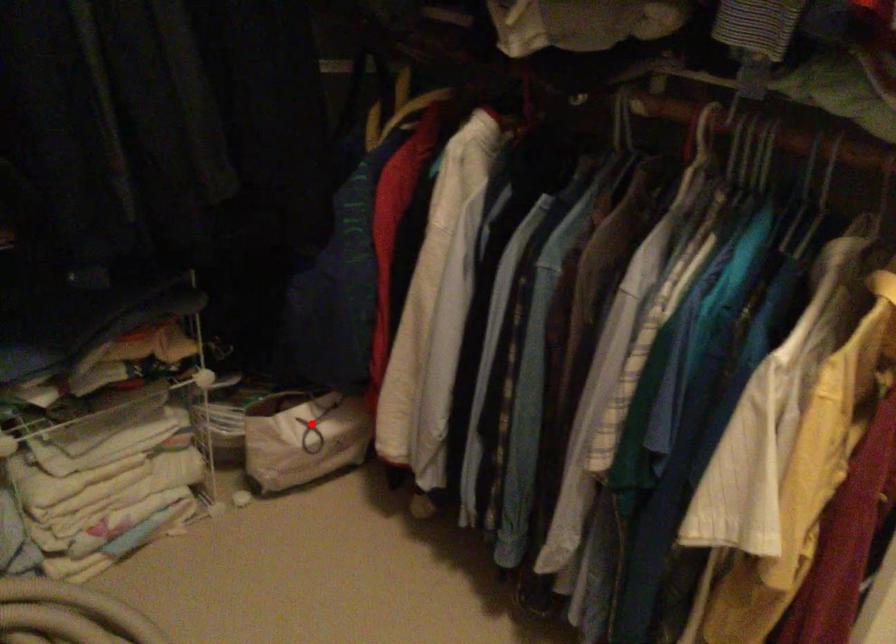
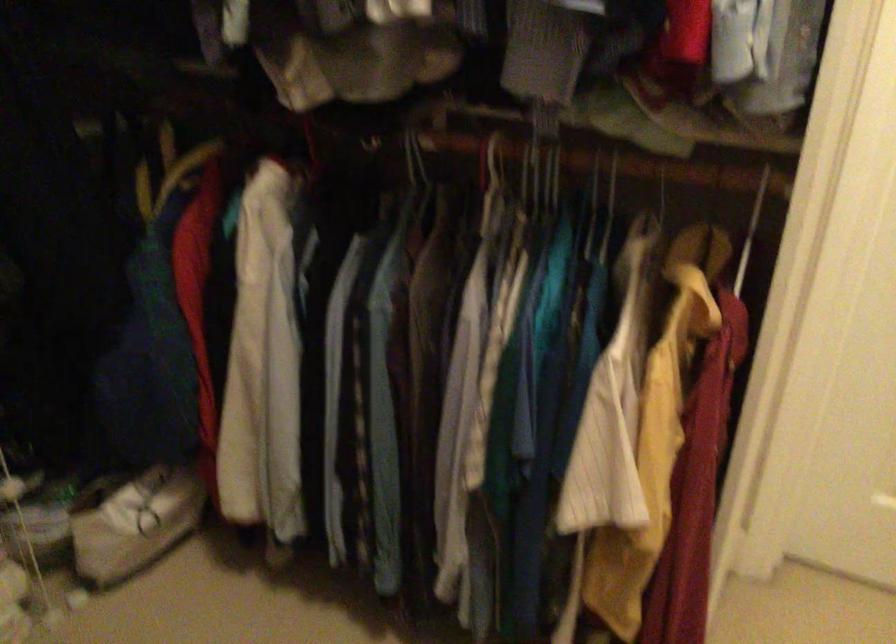
The point at the highlighted location is marked in the first image. Where is the corresponding point in the second image?

(149, 506)